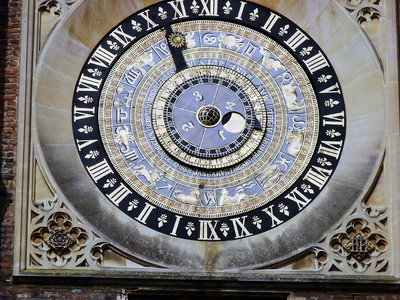
This screenshot has width=400, height=300. Identify the location of clock. coord(366,119).